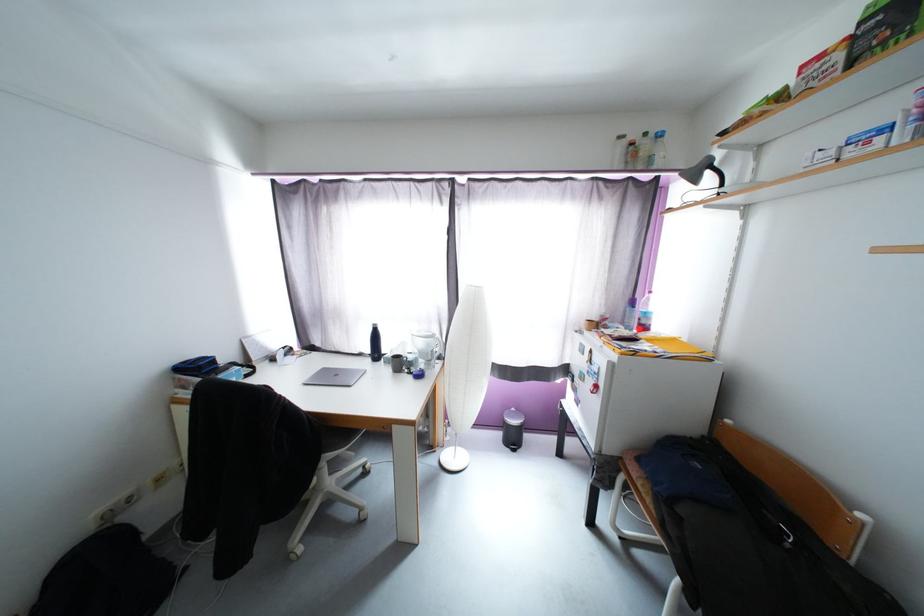
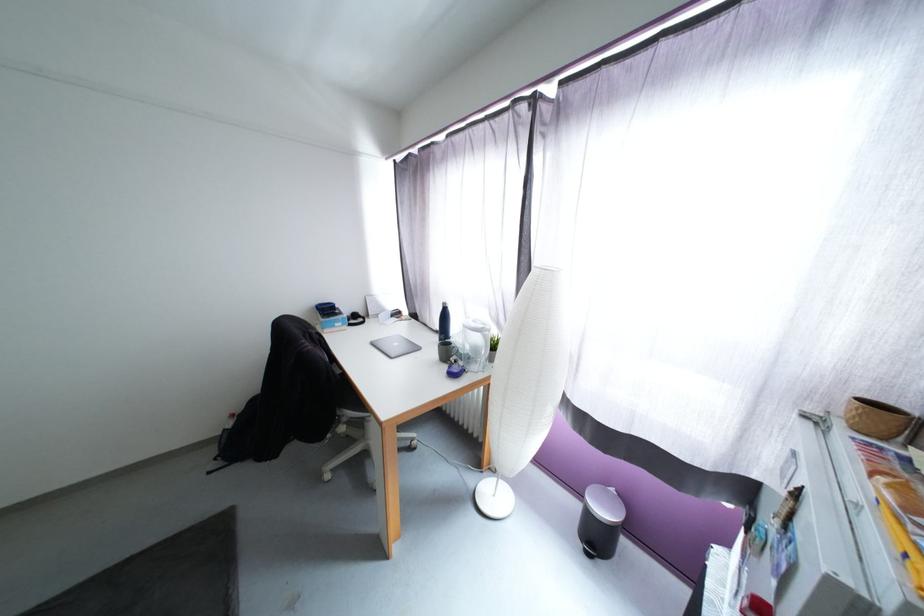
Question: The camera is either moving clockwise (left) or counter-clockwise (right) around the object. The first image is from the beginning of the video and the second image is from the end. Is the camera moving left or right when shooting the video?

Choices:
 (A) Left
 (B) Right

Answer: (B)